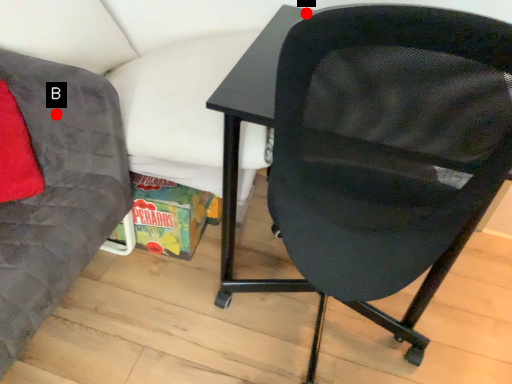
Question: Two points are circled on the image, labeled by A and B beside each circle. Which of the following is the closest to the observer?

Choices:
 (A) A is closer
 (B) B is closer

Answer: (A)